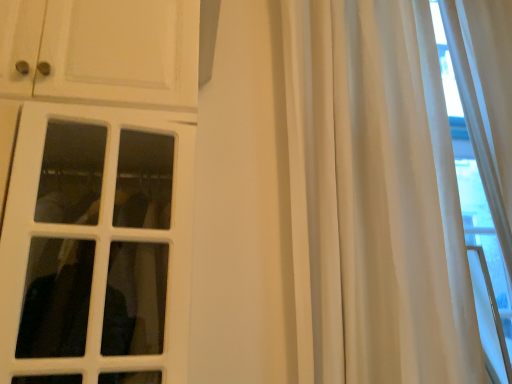
The image size is (512, 384). What do you see at coordinates (376, 196) in the screenshot?
I see `white sheer curtain at right` at bounding box center [376, 196].

Identify the location of white sheer curtain at right. This screenshot has height=384, width=512. (376, 196).

Locate an element on the screen. white sheer curtain at right is located at coordinates (376, 196).